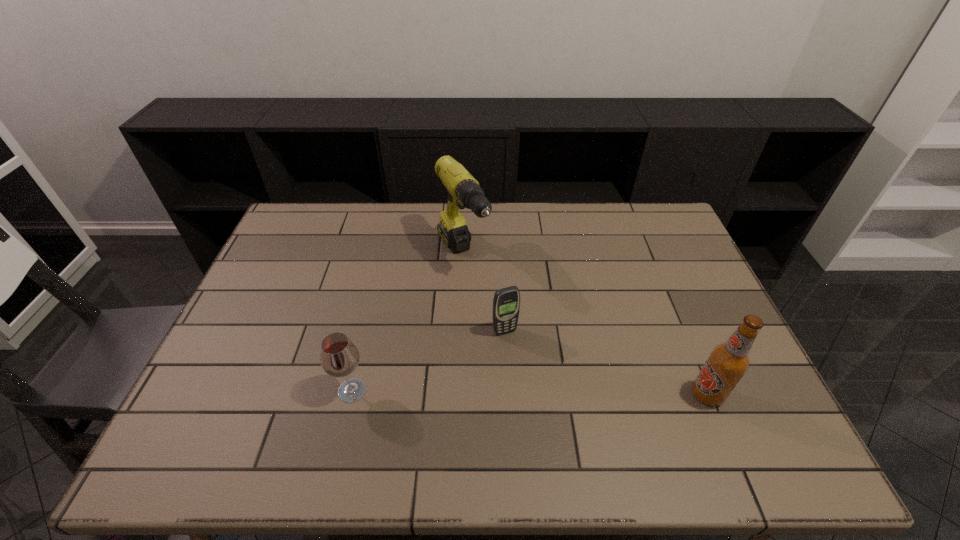
Find the location of a particular element. This screenshot has height=540, width=960. object at the near right corner is located at coordinates 727,363.

Identify the location of free space at the far edge. (516, 226).

Where is `free region at the near edge of the desktop`? This screenshot has width=960, height=540. free region at the near edge of the desktop is located at coordinates (652, 392).

Find the location of a particular element. free region at the left edge of the desktop is located at coordinates click(246, 386).

This screenshot has width=960, height=540. Identify the location of vacant area at the right edge. (669, 273).

This screenshot has width=960, height=540. Find the location of `free space at the far left corner of the desktop`. free space at the far left corner of the desktop is located at coordinates (302, 236).

Where is `vacant area at the far right corner`? This screenshot has width=960, height=540. vacant area at the far right corner is located at coordinates pos(654,231).

You are a GUI agent. You are given a task and a screenshot of the screen. Output one action in this format:
    pyautogui.click(x=<x>, y=<y>)
    Task: Click on the free space between the third object from left to right and the leftmost object
    The height and width of the screenshot is (540, 960).
    Given the screenshot: What is the action you would take?
    pyautogui.click(x=428, y=361)

Image resolution: width=960 pixels, height=540 pixels. What are the coordinates of `empty space that is in between the cellular telephone and the leftmost object` in the screenshot? It's located at (428, 361).

Find the location of `free spot between the wineglass and the third object from left to right`. free spot between the wineglass and the third object from left to right is located at coordinates (428, 361).